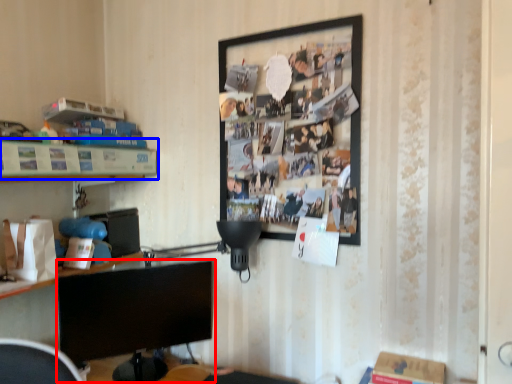
Question: Which object is closer to the camera taking this photo, computer monitor (highlighted by a red box) or shelf (highlighted by a blue box)?

Choices:
 (A) computer monitor
 (B) shelf

Answer: (B)